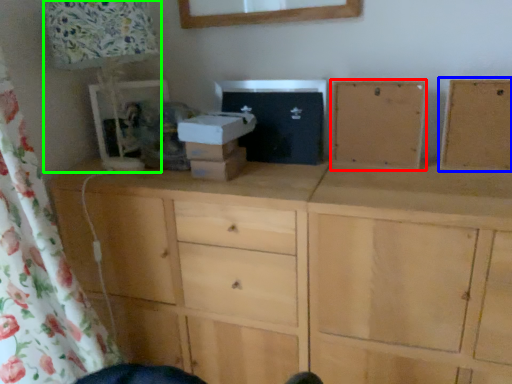
Question: Which is farther away from cabinetry (highlighted by a red box)? cabinetry (highlighted by a blue box) or table lamp (highlighted by a green box)?

Choices:
 (A) cabinetry
 (B) table lamp

Answer: (B)